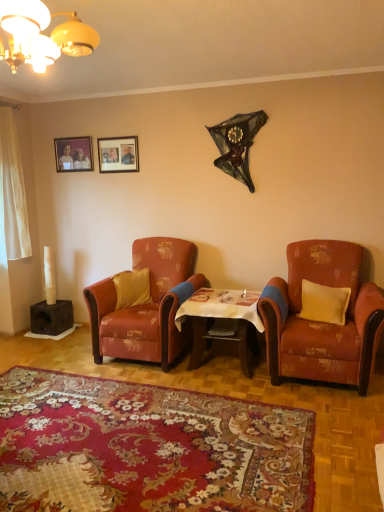
Question: Considering the positions of matte wooden picture frame at upper center, which is the 1th picture frame in right-to-left order, and distressed orange fabric armchair at right, arranged as the second chair when viewed from the left, in the image, is matte wooden picture frame at upper center, which is the 1th picture frame in right-to-left order, taller or shorter than distressed orange fabric armchair at right, arranged as the second chair when viewed from the left,?

Choices:
 (A) short
 (B) tall

Answer: (A)

Question: Is matte wooden picture frame at upper center, acting as the second picture frame starting from the left, inside the boundaries of distressed orange fabric armchair at right, the first chair from the right, or outside?

Choices:
 (A) inside
 (B) outside

Answer: (B)

Question: Estimate the real-world distances between objects in this image. Which object is closer to the yellow velvet pillow at right, the second pillow positioned from the back?

Choices:
 (A) yellow fabric pillow at center, placed as the first pillow when sorted from back to front
 (B) floral carpet at center
 (C) matte wooden picture frame at upper left, which ranks as the first picture frame in left-to-right order
 (D) distressed fabric armchair at center, placed as the second chair when sorted from right to left
 (E) matte wooden picture frame at upper center, acting as the second picture frame starting from the left

Answer: (D)

Question: Which of these objects is positioned farthest from the yellow fabric pillow at center, the second pillow when ordered from right to left?

Choices:
 (A) wooden table at center
 (B) distressed orange fabric armchair at right, arranged as the second chair when viewed from the left
 (C) matte wooden picture frame at upper center, which is the 1th picture frame in right-to-left order
 (D) matte wooden picture frame at upper left, which ranks as the first picture frame in left-to-right order
 (E) floral carpet at center

Answer: (B)